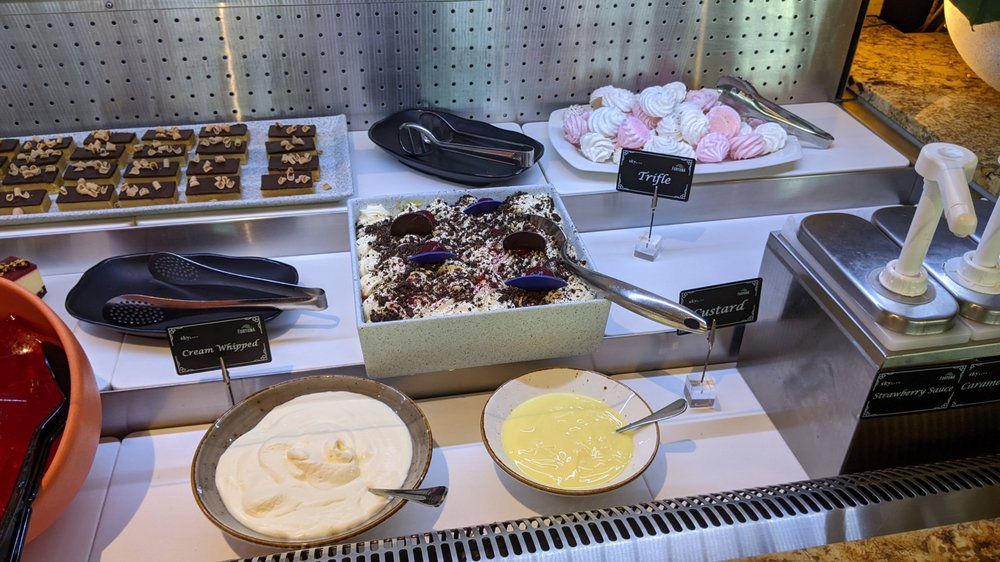
Where is `shelves`? shelves is located at coordinates (402, 176), (637, 264), (696, 442), (315, 330).